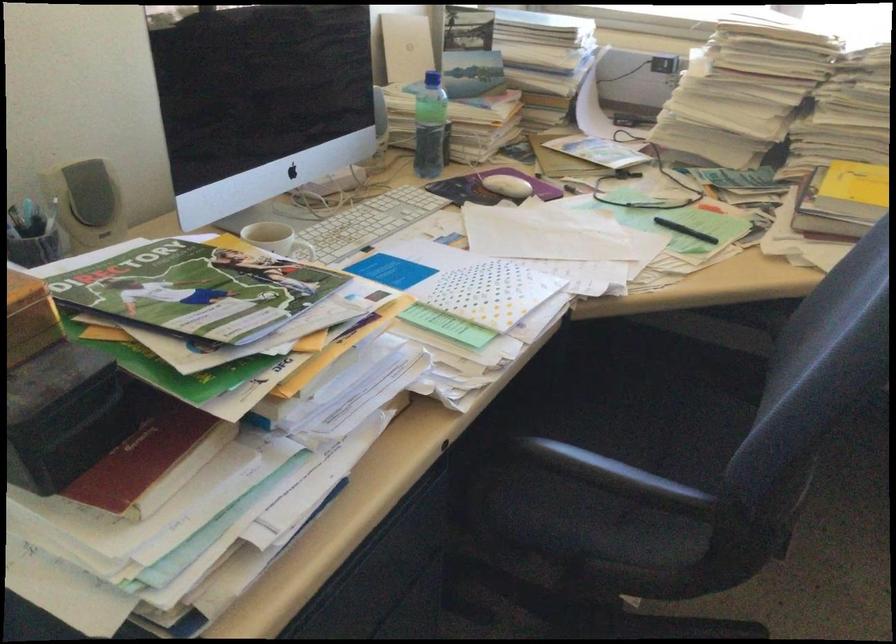
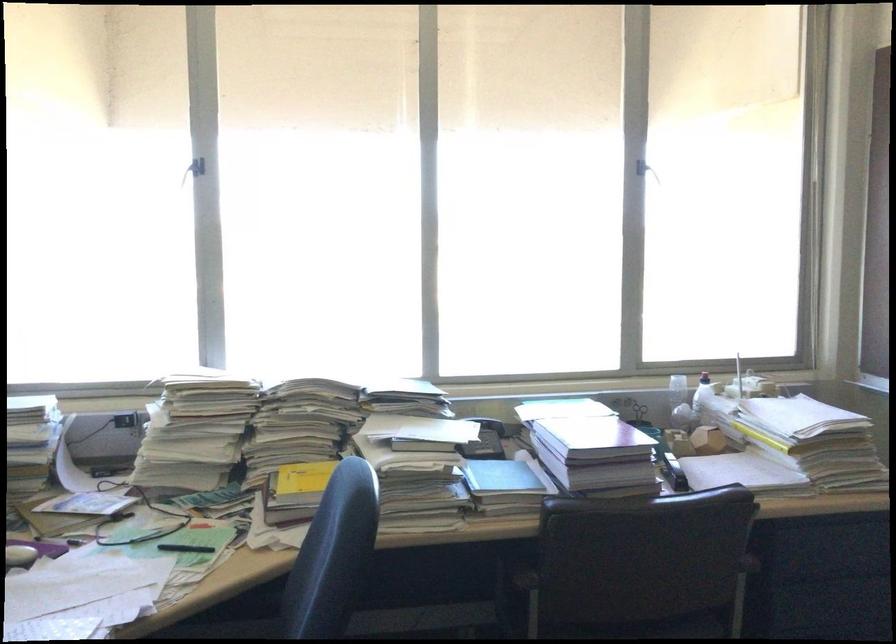
In the second image, find the point that corresponds to [707,323] in the first image.

(225, 629)